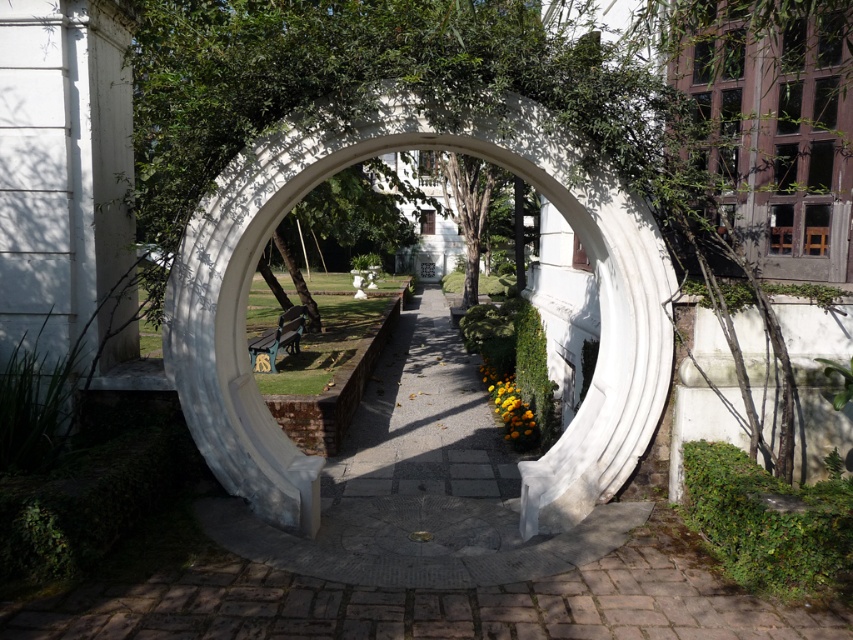
Is white stone path at center in front of white stone archway at center?

Yes, white stone path at center is closer to the viewer.

From the picture: Between white stone path at center and white stone archway at center, which one has less height?

With less height is white stone path at center.

Is point (469, 476) farther from camera compared to point (282, 177)?

Yes, point (469, 476) is farther from viewer.

Find the location of a particular element. The height and width of the screenshot is (640, 853). white stone path at center is located at coordinates (426, 544).